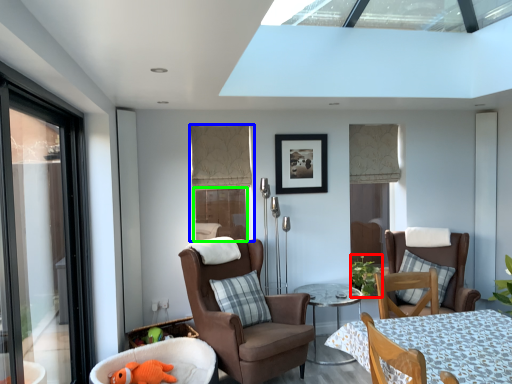
Question: Based on their relative distances, which object is nearer to plant (highlighted by a red box)? Choose from window (highlighted by a blue box) and window (highlighted by a green box).

Choices:
 (A) window
 (B) window

Answer: (B)